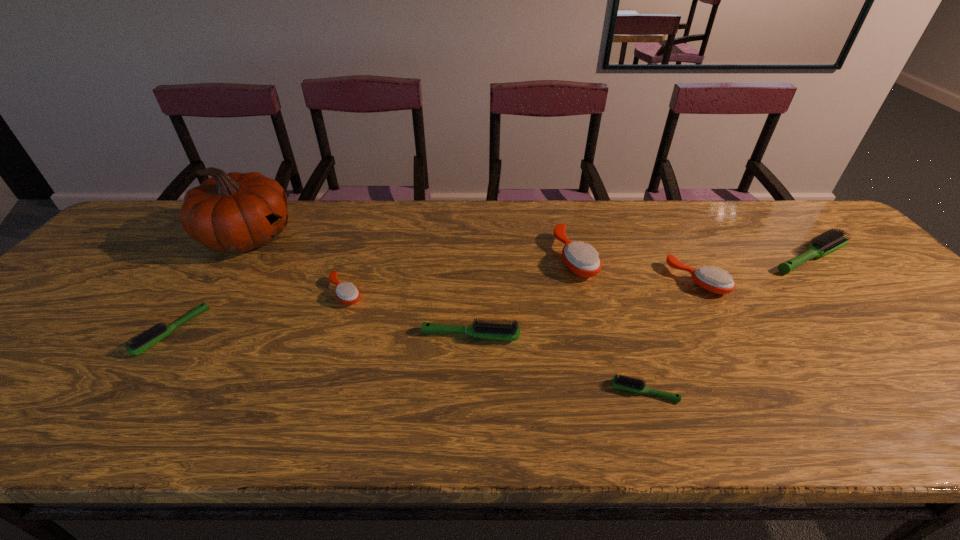
Locate an element on the screen. The height and width of the screenshot is (540, 960). vacant space at the left edge of the desktop is located at coordinates pyautogui.click(x=51, y=344).

Identify the location of vacant space at the right edge of the desktop. (918, 320).

The height and width of the screenshot is (540, 960). In the image, there is a desktop. Identify the location of free region at the far right corner. (771, 206).

At what (x,y) coordinates should I click in order to perform the action: click on free space that is in between the sixth hairbrush from left to right and the third light hairbrush from right to left. Please return your answer as a coordinate pair (x, y). The width and height of the screenshot is (960, 540). Looking at the image, I should click on (584, 308).

Where is `unoccupied area between the biggest light hairbrush and the rightmost orange hairbrush`? The width and height of the screenshot is (960, 540). unoccupied area between the biggest light hairbrush and the rightmost orange hairbrush is located at coordinates (754, 268).

Where is `free space between the pumpkin and the rightmost orange hairbrush`? The width and height of the screenshot is (960, 540). free space between the pumpkin and the rightmost orange hairbrush is located at coordinates point(472,259).

You are a GUI agent. You are given a task and a screenshot of the screen. Output one action in this format:
    pyautogui.click(x=<x>, y=<y>)
    Task: Click on the vacant point located between the sixth object from right to left and the rightmost orange hairbrush
    This screenshot has width=960, height=540.
    Given the screenshot: What is the action you would take?
    [521, 286]

Find the location of `unoccupied position between the seventh object from left to right and the smallest light hairbrush`. unoccupied position between the seventh object from left to right and the smallest light hairbrush is located at coordinates (671, 336).

The width and height of the screenshot is (960, 540). What are the coordinates of `empty space between the third object from left to right and the third hairbrush from left to right` in the screenshot? It's located at (408, 314).

What are the coordinates of `vacant space that is in between the seventh tallest object and the biggest light hairbrush` in the screenshot? It's located at (491, 294).